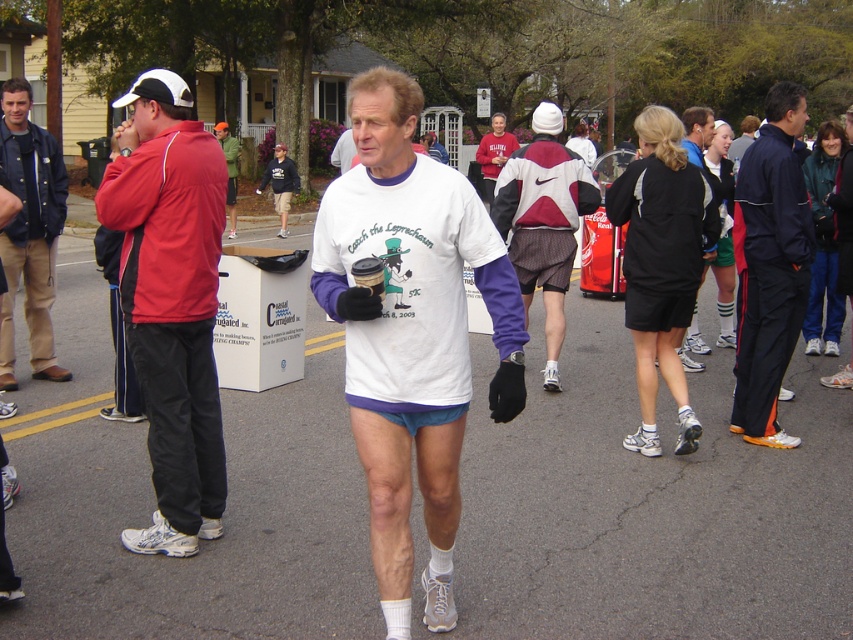
Question: Observing the image, what is the correct spatial positioning of dark blue track suit at right in reference to matte black jacket at left?

Choices:
 (A) left
 (B) right

Answer: (B)

Question: Does red jacket at left appear on the right side of gray/white mesh shorts at center?

Choices:
 (A) yes
 (B) no

Answer: (B)

Question: Which object is closer to the camera taking this photo?

Choices:
 (A) matte black jacket at left
 (B) dark blue track suit at right
 (C) gray/white mesh shorts at center

Answer: (B)

Question: Is dark blue track suit at right smaller than black athletic shorts at center?

Choices:
 (A) no
 (B) yes

Answer: (B)

Question: Which of the following is the closest to the observer?

Choices:
 (A) black fabric shorts at center
 (B) red jacket at left
 (C) black athletic shorts at center

Answer: (B)

Question: Which object appears closest to the camera in this image?

Choices:
 (A) black fabric shorts at center
 (B) red jacket at left
 (C) black athletic shorts at center

Answer: (B)